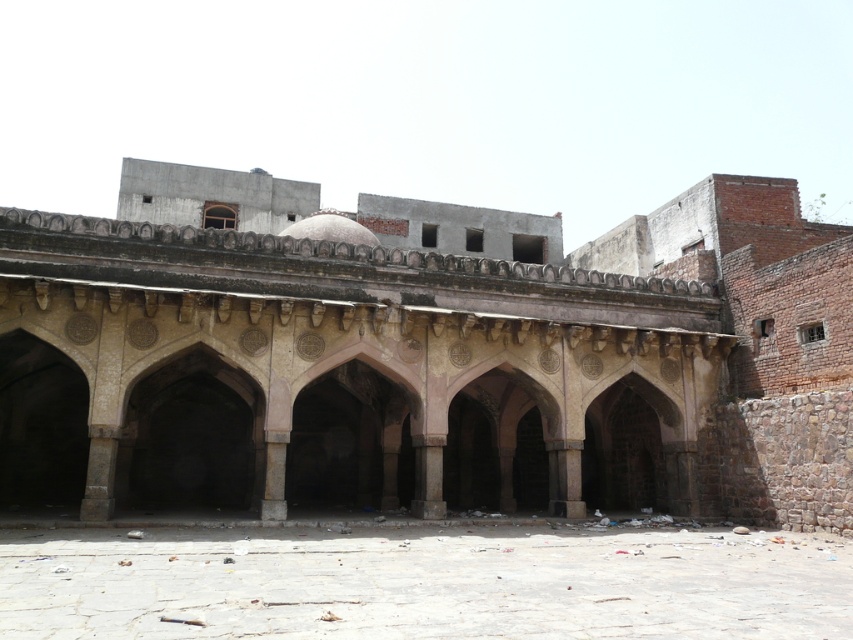
Question: Which point appears closest to the camera in this image?

Choices:
 (A) (253, 616)
 (B) (844, 276)

Answer: (A)

Question: Does stone archway at center have a lesser width compared to stone paved courtyard at center?

Choices:
 (A) yes
 (B) no

Answer: (B)

Question: Does stone archway at center appear under stone paved courtyard at center?

Choices:
 (A) yes
 (B) no

Answer: (B)

Question: Is stone archway at center in front of stone paved courtyard at center?

Choices:
 (A) yes
 (B) no

Answer: (B)

Question: Which point is farther to the camera?

Choices:
 (A) (849, 369)
 (B) (447, 616)

Answer: (A)